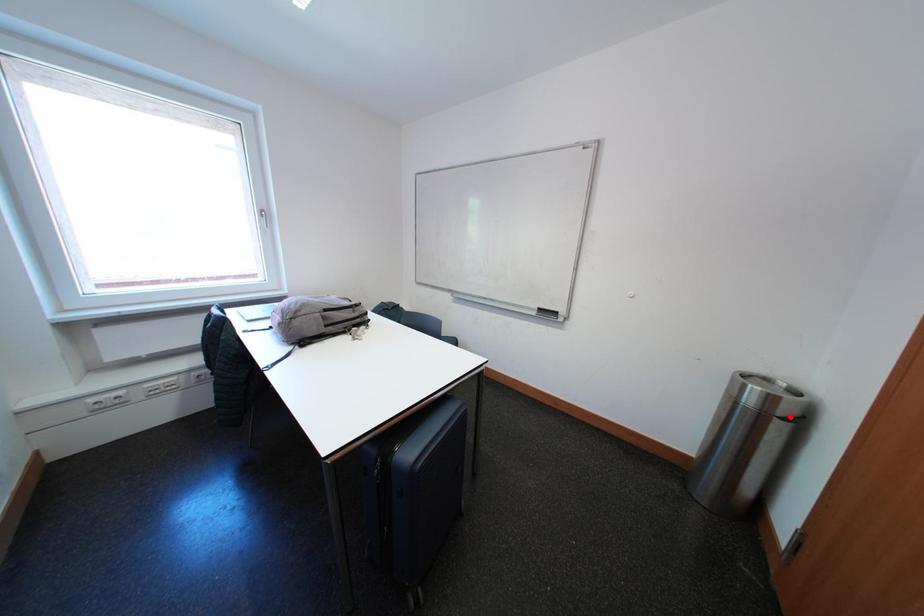
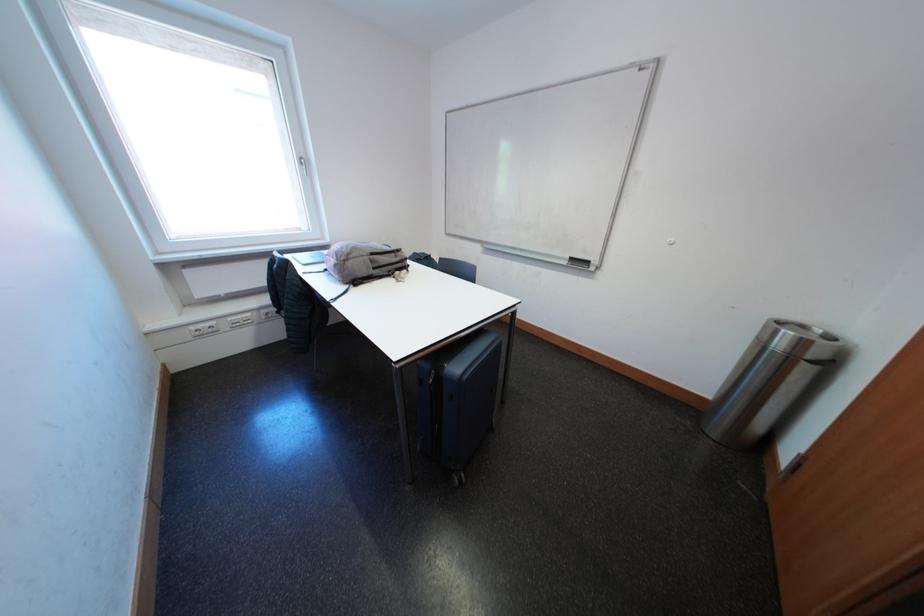
The point at the highlighted location is marked in the first image. Where is the corresponding point in the second image?

(821, 360)